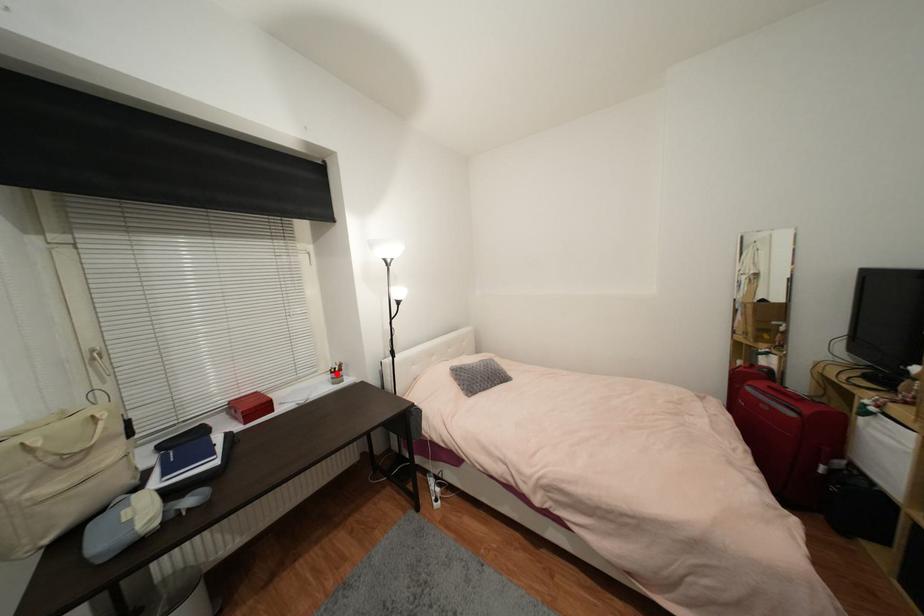
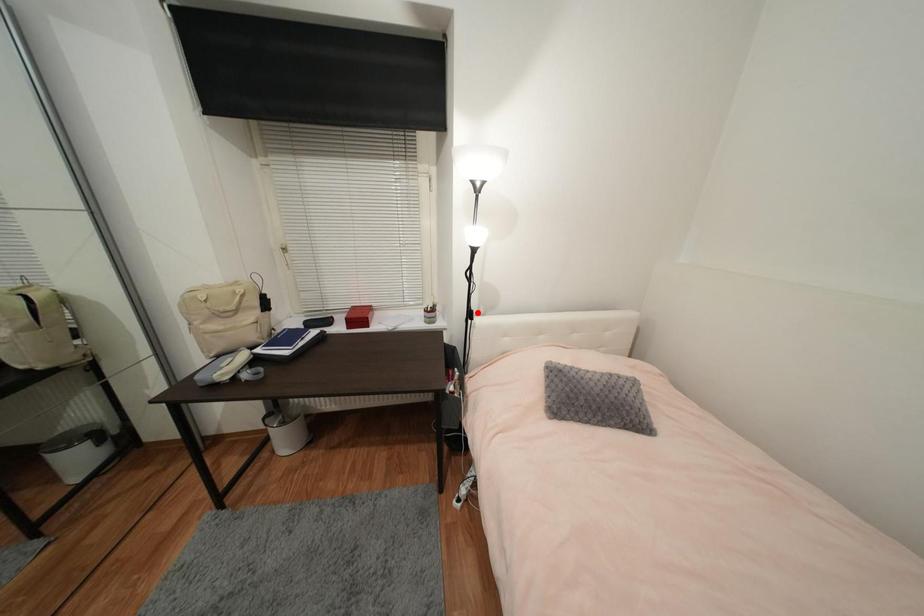
I am providing you with two images of the same scene from different viewpoints. A red point is marked on the first image and another point is marked on the second image. Do the highlighted points in image1 and image2 indicate the same real-world spot?

No